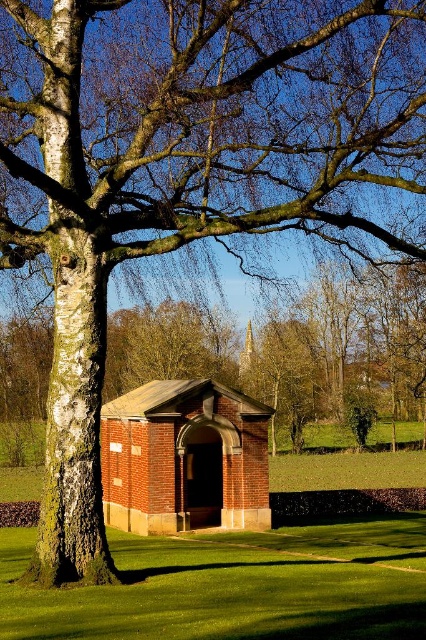
You are standing in the outdoor scene and want to place a small flag at the point closer to you between point [201,577] and point [203,504]. Which point should you choose?

You should choose point [201,577] because it is closer to the camera than point [203,504].